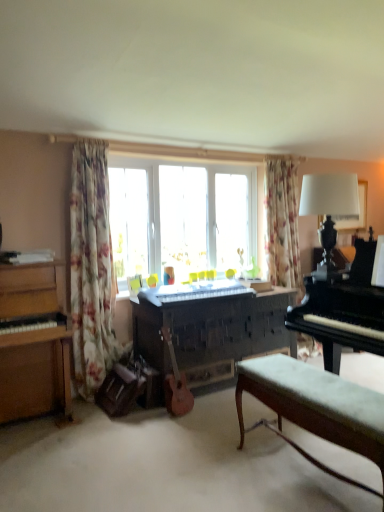
Image resolution: width=384 pixels, height=512 pixels. I want to click on wooden piano at left, the first piano in the left-to-right sequence, so click(x=33, y=343).

The height and width of the screenshot is (512, 384). What are the coordinates of `white glossy picture frame at upper right` in the screenshot? It's located at (359, 213).

What do you see at coordinates (359, 213) in the screenshot?
I see `white glossy picture frame at upper right` at bounding box center [359, 213].

What is the approximate width of velvet green bench at lower right?

The width of velvet green bench at lower right is 14.27 inches.

The width and height of the screenshot is (384, 512). Describe the element at coordinates (176, 385) in the screenshot. I see `wooden acoustic guitar at center` at that location.

The width and height of the screenshot is (384, 512). What are the coordinates of `wooden piano at left, the first piano in the left-to-right sequence` in the screenshot? It's located at (33, 343).

Is wooden acoustic guitar at center oriented away from velvet green bench at lower right?

wooden acoustic guitar at center is not turned away from velvet green bench at lower right.

Are wooden acoustic guitar at center and velvet green bench at lower right located far from each other?

No, wooden acoustic guitar at center is in close proximity to velvet green bench at lower right.

From the image's perspective, relative to velvet green bench at lower right, is wooden acoustic guitar at center above or below?

Based on their image positions, wooden acoustic guitar at center is located above velvet green bench at lower right.

Does black polished piano at right, the 3th piano viewed from the left, have a smaller size compared to floral fabric curtain at upper right, marked as the 2th curtain in a left-to-right arrangement?

Incorrect, black polished piano at right, the 3th piano viewed from the left, is not smaller in size than floral fabric curtain at upper right, marked as the 2th curtain in a left-to-right arrangement.

Is floral fabric curtain at upper right, marked as the 2th curtain in a left-to-right arrangement, at the back of black polished piano at right, the 3th piano viewed from the left?

No, black polished piano at right, the 3th piano viewed from the left,'s orientation is not away from floral fabric curtain at upper right, marked as the 2th curtain in a left-to-right arrangement.

Which is behind, point (315, 309) or point (292, 163)?

Point (292, 163)

From the image's perspective, which is below, black polished piano at right, the 3th piano viewed from the left, or floral fabric curtain at upper right, the 1th curtain positioned from the back?

black polished piano at right, the 3th piano viewed from the left, appears lower in the image.

Considering the sizes of objects wooden piano at left, the first piano in the left-to-right sequence, and floral fabric curtain at upper right, the 1th curtain positioned from the back, in the image provided, who is bigger, wooden piano at left, the first piano in the left-to-right sequence, or floral fabric curtain at upper right, the 1th curtain positioned from the back,?

wooden piano at left, the first piano in the left-to-right sequence, is bigger.

Is wooden piano at left, which is the third piano from right to left, positioned before floral fabric curtain at upper right, marked as the 2th curtain in a left-to-right arrangement?

Yes, it is in front of floral fabric curtain at upper right, marked as the 2th curtain in a left-to-right arrangement.

From the image's perspective, which one is positioned lower, wooden piano at left, which is the third piano from right to left, or floral fabric curtain at upper right, marked as the 2th curtain in a left-to-right arrangement?

wooden piano at left, which is the third piano from right to left.

Is floral fabric curtain at upper right, marked as the first curtain in a right-to-left arrangement, completely or partially inside wooden piano at left, the first piano in the left-to-right sequence?

No, floral fabric curtain at upper right, marked as the first curtain in a right-to-left arrangement, is not surrounded by wooden piano at left, the first piano in the left-to-right sequence.

Can you confirm if wooden acoustic guitar at center is positioned to the right of black polished piano at right, the 3th piano viewed from the left?

No, wooden acoustic guitar at center is not to the right of black polished piano at right, the 3th piano viewed from the left.

Can you tell me how much wooden acoustic guitar at center and black polished piano at right, which is counted as the 1th piano, starting from the right, differ in facing direction?

There is a 90-degree angle between the facing directions of wooden acoustic guitar at center and black polished piano at right, which is counted as the 1th piano, starting from the right.

Based on the photo, who is smaller, wooden acoustic guitar at center or black polished piano at right, which is counted as the 1th piano, starting from the right?

With smaller size is wooden acoustic guitar at center.

Is point (166, 379) closer to viewer compared to point (362, 250)?

Yes, it is.

From a real-world perspective, is white glossy picture frame at upper right above or below floral fabric curtain at upper right, the 1th curtain positioned from the back?

In terms of real-world spatial position, white glossy picture frame at upper right is above floral fabric curtain at upper right, the 1th curtain positioned from the back.

Is point (357, 223) closer or farther from the camera than point (297, 177)?

Clearly, point (357, 223) is closer to the camera than point (297, 177).

Which of these two, white glossy picture frame at upper right or floral fabric curtain at upper right, which is the 2th curtain in front-to-back order, is smaller?

white glossy picture frame at upper right.

From a real-world perspective, who is located higher, wooden acoustic guitar at center or dark wood piano at center, which is counted as the second piano, starting from the right?

dark wood piano at center, which is counted as the second piano, starting from the right.

Is wooden acoustic guitar at center far away from dark wood piano at center, which is counted as the second piano, starting from the right?

That's not correct — wooden acoustic guitar at center is a little close to dark wood piano at center, which is counted as the second piano, starting from the right.

Which is closer, (167, 408) or (238, 323)?

Point (167, 408) is closer to the camera than point (238, 323).

Which point is more forward, (331,420) or (295,210)?

Point (331,420)

How distant is velvet green bench at lower right from floral fabric curtain at upper right, marked as the first curtain in a right-to-left arrangement?

velvet green bench at lower right and floral fabric curtain at upper right, marked as the first curtain in a right-to-left arrangement, are 6.88 feet apart.

Would you say floral fabric curtain at upper right, the 1th curtain positioned from the back, is part of velvet green bench at lower right's contents?

That's incorrect, floral fabric curtain at upper right, the 1th curtain positioned from the back, is not inside velvet green bench at lower right.

You are a GUI agent. You are given a task and a screenshot of the screen. Output one action in this format:
    pyautogui.click(x=<x>, y=<y>)
    Task: Click on the guitar that is behind the velvet green bench at lower right
    The image size is (384, 512).
    Given the screenshot: What is the action you would take?
    pyautogui.click(x=176, y=385)

From the floral fabric curtain at upper right, marked as the first curtain in a right-to-left arrangement, count 3rd pianos forward and point to it. Please provide its 2D coordinates.

[(343, 309)]

Looking at the image, which one is located closer to wooden piano at left, which is the third piano from right to left, floral fabric curtain at left, the 1th curtain in the left-to-right sequence, or white glossy picture frame at upper right?

The object closer to wooden piano at left, which is the third piano from right to left, is floral fabric curtain at left, the 1th curtain in the left-to-right sequence.

Which object lies further to the anchor point velvet green bench at lower right, floral fabric curtain at upper right, marked as the first curtain in a right-to-left arrangement, or wooden acoustic guitar at center?

floral fabric curtain at upper right, marked as the first curtain in a right-to-left arrangement, is further to velvet green bench at lower right.

Which object lies nearer to the anchor point wooden acoustic guitar at center, black polished piano at right, which is counted as the 1th piano, starting from the right, or floral fabric curtain at left, which is counted as the 1th curtain, starting from the front?

Among the two, floral fabric curtain at left, which is counted as the 1th curtain, starting from the front, is located nearer to wooden acoustic guitar at center.

From the image, which object appears to be farther from floral fabric curtain at left, the 2th curtain in the right-to-left sequence, wooden piano at left, which is the third piano from right to left, or velvet green bench at lower right?

Among the two, velvet green bench at lower right is located further to floral fabric curtain at left, the 2th curtain in the right-to-left sequence.

Which object lies further to the anchor point white fabric lampshade at upper right, wooden acoustic guitar at center or black polished piano at right, which is counted as the 1th piano, starting from the right?

wooden acoustic guitar at center is positioned further to the anchor white fabric lampshade at upper right.

Consider the image. Estimate the real-world distances between objects in this image. Which object is closer to dark wood piano at center, which is counted as the second piano, starting from the right, white fabric lampshade at upper right or black polished piano at right, the 3th piano viewed from the left?

The object closer to dark wood piano at center, which is counted as the second piano, starting from the right, is black polished piano at right, the 3th piano viewed from the left.

Which object lies further to the anchor point wooden acoustic guitar at center, velvet green bench at lower right or transparent glass window at center?

Among the two, transparent glass window at center is located further to wooden acoustic guitar at center.

Which object lies further to the anchor point wooden acoustic guitar at center, white glossy picture frame at upper right or transparent glass window at center?

Among the two, white glossy picture frame at upper right is located further to wooden acoustic guitar at center.

The width and height of the screenshot is (384, 512). What are the coordinates of `piano located between wooden acoustic guitar at center and white glossy picture frame at upper right in the depth direction` in the screenshot? It's located at (210, 327).

Identify the location of guitar between velvet green bench at lower right and dark wood piano at center, which is counted as the second piano, starting from the right, from front to back. The image size is (384, 512). (176, 385).

Find the location of a particular element. The image size is (384, 512). window between wooden piano at left, the first piano in the left-to-right sequence, and white glossy picture frame at upper right is located at coordinates (181, 216).

I want to click on window between velvet green bench at lower right and floral fabric curtain at upper right, the 1th curtain positioned from the back, from front to back, so click(x=181, y=216).